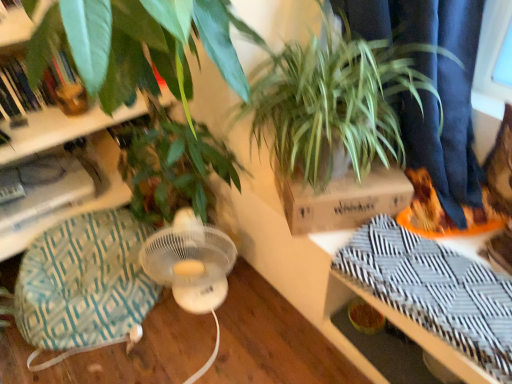
Question: Considering the positions of point (462, 230) and point (300, 223), is point (462, 230) closer or farther from the camera than point (300, 223)?

Choices:
 (A) closer
 (B) farther

Answer: (B)

Question: From the image's perspective, relative to brown cardboard box at upper center, is orange matte shoe at right above or below?

Choices:
 (A) below
 (B) above

Answer: (A)

Question: Estimate the real-world distances between objects in this image. Which object is closer to the green woven swivel chair at lower left?

Choices:
 (A) green leafy plant at upper right
 (B) white plastic fan at lower left
 (C) orange matte shoe at right
 (D) brown cardboard box at upper center

Answer: (B)

Question: Estimate the real-world distances between objects in this image. Which object is closer to the orange matte shoe at right?

Choices:
 (A) brown cardboard box at upper center
 (B) white plastic fan at lower left
 (C) green woven swivel chair at lower left
 (D) green leafy plant at upper right

Answer: (A)